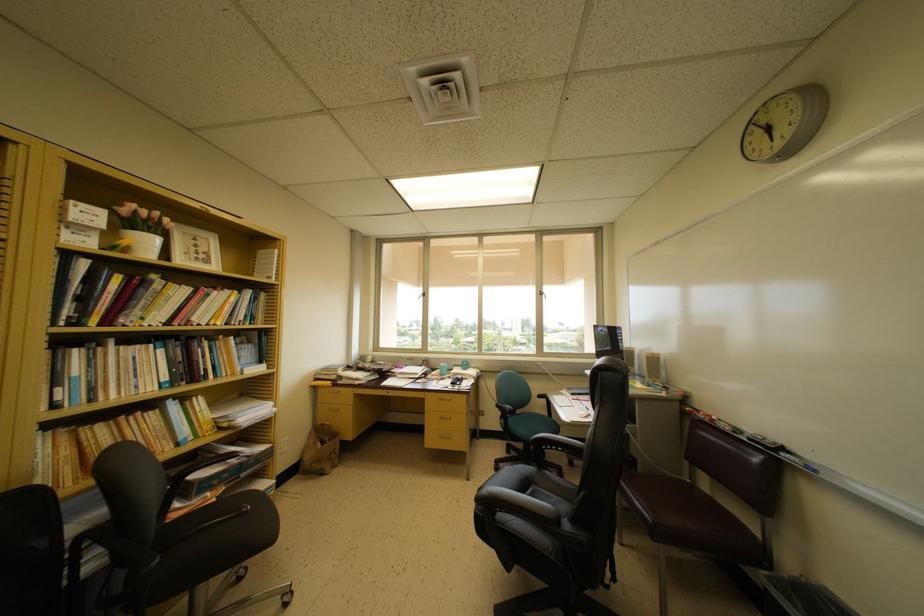
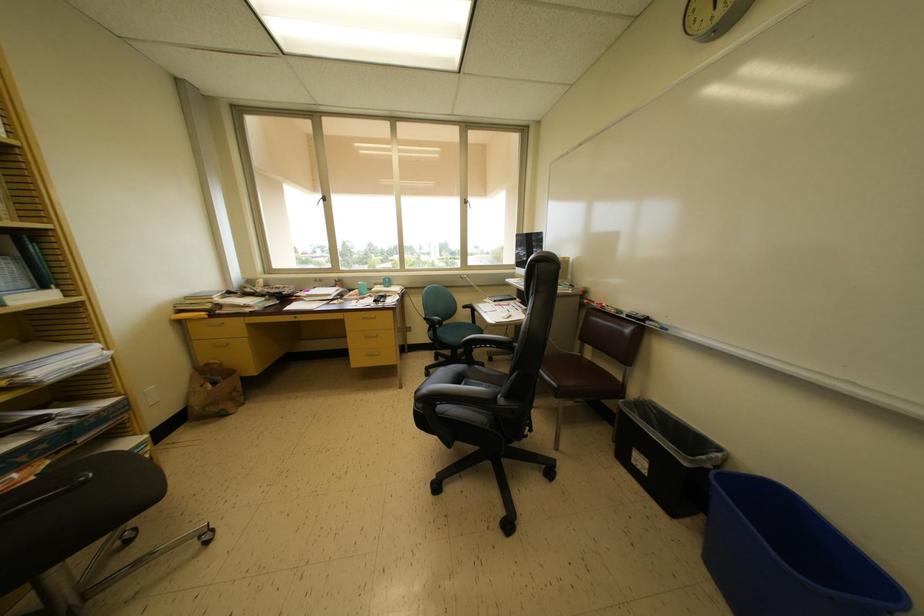
First-person continuous shooting, in which direction is the camera rotating?

The camera rotated toward right-down.